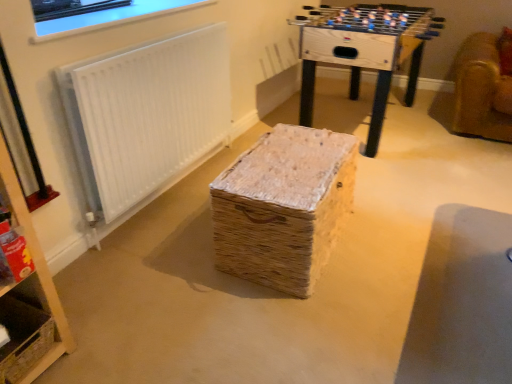
This screenshot has width=512, height=384. What do you see at coordinates (23, 338) in the screenshot?
I see `woven straw basket at lower left` at bounding box center [23, 338].

The width and height of the screenshot is (512, 384). What do you see at coordinates (364, 51) in the screenshot?
I see `wooden foosball table at upper center` at bounding box center [364, 51].

Describe the element at coordinates (283, 206) in the screenshot. The width and height of the screenshot is (512, 384). I see `woven straw basket at center` at that location.

Locate an element on the screen. This screenshot has width=512, height=384. woven straw basket at lower left is located at coordinates (23, 338).

Which of these two, wooden foosball table at upper center or woven straw basket at lower left, stands taller?

wooden foosball table at upper center is taller.

Which object is further away from the camera, wooden foosball table at upper center or woven straw basket at lower left?

wooden foosball table at upper center is more distant.

Is wooden foosball table at upper center wider or thinner than woven straw basket at lower left?

wooden foosball table at upper center is wider than woven straw basket at lower left.

At what (x,y) coordinates should I click in order to perform the action: click on table on the right of woven straw basket at lower left. Please return your answer as a coordinate pair (x, y). The width and height of the screenshot is (512, 384). Looking at the image, I should click on (364, 51).

Consider the image. Is woven straw basket at center turned away from clear glass window at upper left?

No, woven straw basket at center is not facing away from clear glass window at upper left.

Is woven straw basket at center at the left side of clear glass window at upper left?

No.

From the image's perspective, which object appears higher, woven straw basket at center or clear glass window at upper left?

From the image's view, clear glass window at upper left is above.

Which object is wider, woven straw basket at lower left or wooden foosball table at upper center?

With larger width is wooden foosball table at upper center.

Can wooden foosball table at upper center be found inside woven straw basket at lower left?

No, wooden foosball table at upper center is not surrounded by woven straw basket at lower left.

Which is more distant, [14,381] or [370,147]?

Positioned behind is point [370,147].

Considering the sizes of objects clear glass window at upper left and wooden foosball table at upper center in the image provided, who is thinner, clear glass window at upper left or wooden foosball table at upper center?

clear glass window at upper left.

What's the angular difference between clear glass window at upper left and wooden foosball table at upper center's facing directions?

They differ by 1.22 degrees in their facing directions.

Is clear glass window at upper left positioned with its back to wooden foosball table at upper center?

No.

Consider the image. Are clear glass window at upper left and wooden foosball table at upper center making contact?

No, clear glass window at upper left is not next to wooden foosball table at upper center.

Are white textured radiator at upper left and woven straw basket at center located far from each other?

No, there isn't a large distance between white textured radiator at upper left and woven straw basket at center.

Is white textured radiator at upper left aimed at woven straw basket at center?

Yes, white textured radiator at upper left faces towards woven straw basket at center.

Are woven straw basket at center and white textured radiator at upper left making contact?

No, woven straw basket at center is not touching white textured radiator at upper left.

Considering the sizes of objects woven straw basket at center and white textured radiator at upper left in the image provided, who is shorter, woven straw basket at center or white textured radiator at upper left?

With less height is woven straw basket at center.

From the image's perspective, is woven straw basket at center positioned above or below white textured radiator at upper left?

woven straw basket at center is below white textured radiator at upper left.

How many degrees apart are the facing directions of woven straw basket at center and white textured radiator at upper left?

2.37 degrees separate the facing orientations of woven straw basket at center and white textured radiator at upper left.

Does wooden foosball table at upper center have a greater width compared to clear glass window at upper left?

Indeed, wooden foosball table at upper center has a greater width compared to clear glass window at upper left.

Consider the image. Is wooden foosball table at upper center looking in the opposite direction of clear glass window at upper left?

That's not correct — wooden foosball table at upper center is not looking away from clear glass window at upper left.

Is wooden foosball table at upper center not close to clear glass window at upper left?

wooden foosball table at upper center is far away from clear glass window at upper left.

This screenshot has width=512, height=384. I want to click on basket on the left of wooden foosball table at upper center, so click(x=23, y=338).

Where is `furniture on the right of the clear glass window at upper left`? This screenshot has width=512, height=384. furniture on the right of the clear glass window at upper left is located at coordinates (283, 206).

From the image, which object appears to be farther from wooden foosball table at upper center, woven straw basket at lower left or clear glass window at upper left?

woven straw basket at lower left is positioned further to the anchor wooden foosball table at upper center.

Estimate the real-world distances between objects in this image. Which object is further from white textured radiator at upper left, woven straw basket at lower left or clear glass window at upper left?

woven straw basket at lower left.

Based on their spatial positions, is clear glass window at upper left or woven straw basket at lower left further from wooden foosball table at upper center?

woven straw basket at lower left.

From the image, which object appears to be farther from wooden foosball table at upper center, woven straw basket at center or white textured radiator at upper left?

woven straw basket at center lies further to wooden foosball table at upper center than the other object.

When comparing their distances from clear glass window at upper left, does wooden foosball table at upper center or woven straw basket at lower left seem closer?

wooden foosball table at upper center is closer to clear glass window at upper left.

Considering their positions, is clear glass window at upper left positioned closer to woven straw basket at center than wooden foosball table at upper center?

clear glass window at upper left is positioned closer to the anchor woven straw basket at center.

Based on their spatial positions, is woven straw basket at lower left or wooden foosball table at upper center closer to clear glass window at upper left?

Among the two, wooden foosball table at upper center is located nearer to clear glass window at upper left.

Considering their positions, is woven straw basket at center positioned further to clear glass window at upper left than woven straw basket at lower left?

Based on the image, woven straw basket at lower left appears to be further to clear glass window at upper left.

At what (x,y) coordinates should I click in order to perform the action: click on radiator located between woven straw basket at lower left and wooden foosball table at upper center in the left-right direction. Please return your answer as a coordinate pair (x, y). Looking at the image, I should click on (146, 119).

The image size is (512, 384). I want to click on furniture between woven straw basket at lower left and wooden foosball table at upper center in the horizontal direction, so (283, 206).

In order to click on radiator between clear glass window at upper left and woven straw basket at lower left in the up-down direction in this screenshot , I will do `click(146, 119)`.

Where is `furniture situated between white textured radiator at upper left and wooden foosball table at upper center from left to right`? furniture situated between white textured radiator at upper left and wooden foosball table at upper center from left to right is located at coordinates (283, 206).